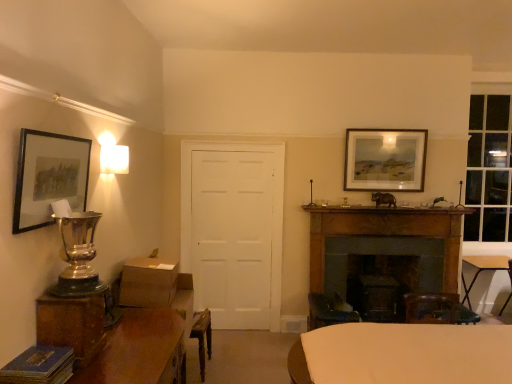
At what (x,y) coordinates should I click in order to perform the action: click on free point above wooden table at lower left, arranged as the 3th table when viewed from the back (from a real-world perspective). Please return your answer as a coordinate pair (x, y). The image size is (512, 384). Looking at the image, I should click on (x=126, y=335).